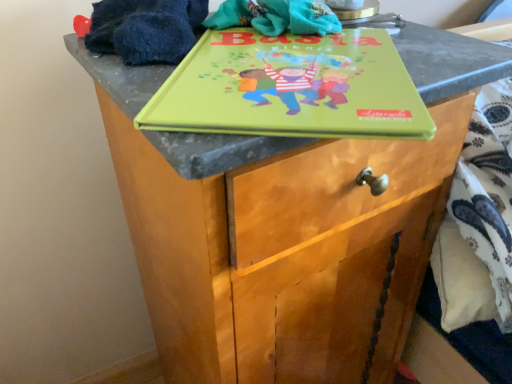
Identify the location of vacant region above green matte book at center (from a real-world perspective). The width and height of the screenshot is (512, 384). (292, 63).